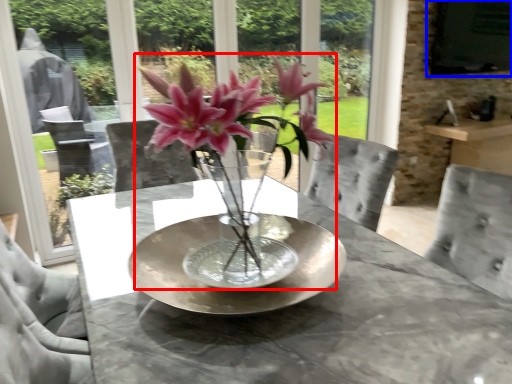
Question: Which object is further to the camera taking this photo, houseplant (highlighted by a red box) or window screen (highlighted by a blue box)?

Choices:
 (A) houseplant
 (B) window screen

Answer: (B)